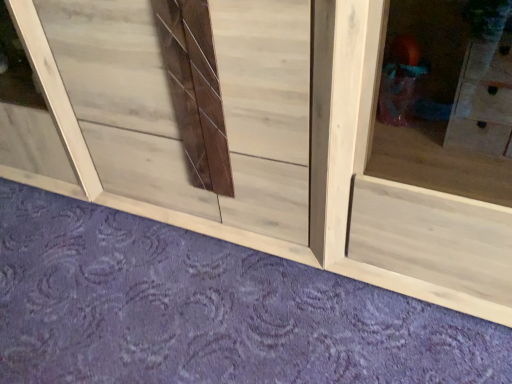
Question: Does point (291, 306) appear closer or farther from the camera than point (79, 168)?

Choices:
 (A) farther
 (B) closer

Answer: (B)

Question: Is natural wood cabinet at lower center bigger or smaller than natural wood window frame at lower left?

Choices:
 (A) small
 (B) big

Answer: (A)

Question: In terms of width, does natural wood cabinet at lower center look wider or thinner when compared to natural wood window frame at lower left?

Choices:
 (A) thin
 (B) wide

Answer: (B)

Question: From the image's perspective, is natural wood window frame at lower left above or below natural wood cabinet at lower center?

Choices:
 (A) below
 (B) above

Answer: (B)

Question: From a real-world perspective, is natural wood window frame at lower left physically located above or below natural wood cabinet at lower center?

Choices:
 (A) above
 (B) below

Answer: (A)

Question: Looking at their shapes, would you say natural wood window frame at lower left is wider or thinner than natural wood cabinet at lower center?

Choices:
 (A) thin
 (B) wide

Answer: (A)

Question: Considering the positions of point [22, 34] and point [6, 284], is point [22, 34] closer or farther from the camera than point [6, 284]?

Choices:
 (A) closer
 (B) farther

Answer: (A)